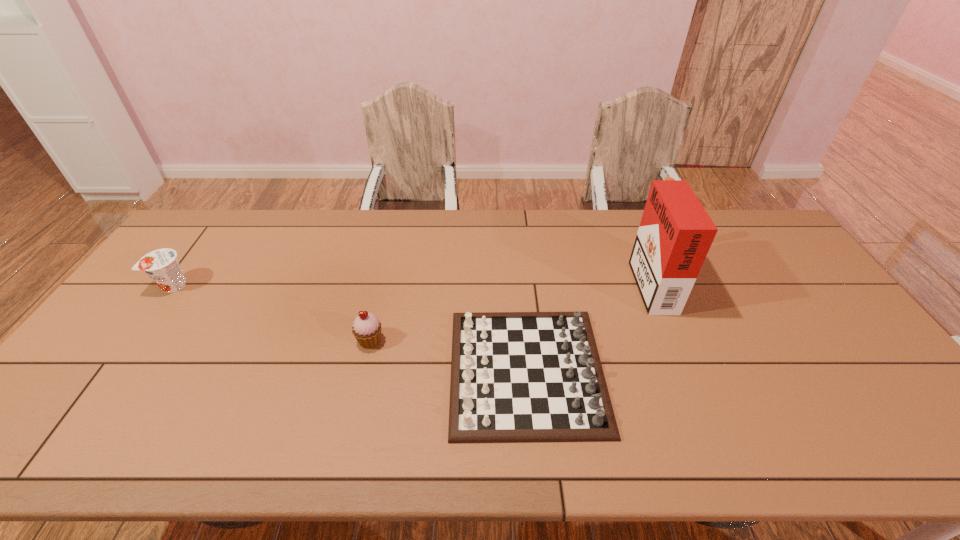
Where is `blank space located 0.180m on the back of the leftmost object`? blank space located 0.180m on the back of the leftmost object is located at coordinates (207, 239).

This screenshot has width=960, height=540. I want to click on vacant area located on the left of the second object from right to left, so click(x=333, y=370).

Image resolution: width=960 pixels, height=540 pixels. I want to click on object that is at the near edge, so click(515, 376).

Locate an element on the screen. object at the left edge is located at coordinates (161, 265).

At what (x,y) coordinates should I click in order to perform the action: click on vacant space at the far edge of the desktop. Please return your answer as a coordinate pair (x, y). The width and height of the screenshot is (960, 540). Looking at the image, I should click on (317, 217).

Image resolution: width=960 pixels, height=540 pixels. Find the location of `free space at the near edge of the desktop`. free space at the near edge of the desktop is located at coordinates (146, 432).

You are a GUI agent. You are given a task and a screenshot of the screen. Output one action in this format:
    pyautogui.click(x=<x>, y=<y>)
    Task: Click on the free space at the left edge
    This screenshot has height=540, width=960.
    Given the screenshot: What is the action you would take?
    pyautogui.click(x=204, y=257)

Where is `vacant area at the right edge of the desktop`? This screenshot has width=960, height=540. vacant area at the right edge of the desktop is located at coordinates (883, 386).

This screenshot has width=960, height=540. What are the coordinates of `free region at the far left corner` in the screenshot? It's located at (228, 224).

The image size is (960, 540). I want to click on free location at the far right corner of the desktop, so click(752, 248).